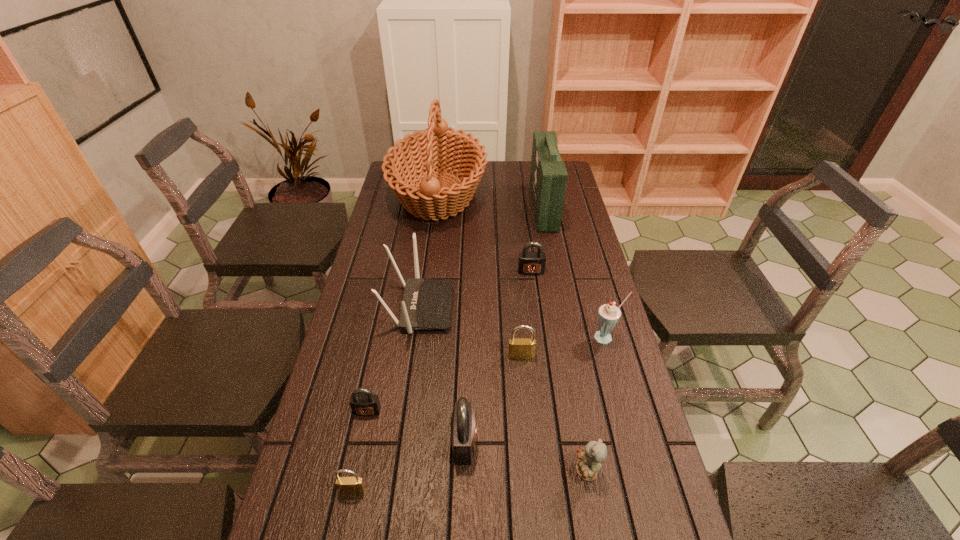
What are the coordinates of `basket` in the screenshot? It's located at (439, 195).

At what (x,y) coordinates should I click in order to perform the action: click on brown basket. Please return your answer as a coordinate pair (x, y). The width and height of the screenshot is (960, 540). Looking at the image, I should click on (439, 195).

Locate an element on the screen. the ninth shortest object is located at coordinates (548, 176).

Find the location of a particular element. The width and height of the screenshot is (960, 540). router is located at coordinates (427, 303).

In order to click on milkshake in this screenshot , I will do `click(608, 315)`.

At what (x,y) coordinates should I click in order to perform the action: click on white milkshake. Please return your answer as a coordinate pair (x, y). Looking at the image, I should click on (608, 315).

You are a GUI agent. You are given a task and a screenshot of the screen. Output one action in this format:
    pyautogui.click(x=<x>, y=<y>)
    Task: Click on the second gray padlock from right to left
    
    Given the screenshot: What is the action you would take?
    pyautogui.click(x=463, y=424)

Identify the location of the third padlock from right to left. This screenshot has height=540, width=960. (463, 424).

The height and width of the screenshot is (540, 960). I want to click on the second smallest gray padlock, so click(529, 263).

Locate an element on the screen. The width and height of the screenshot is (960, 540). the farthest padlock is located at coordinates (529, 263).